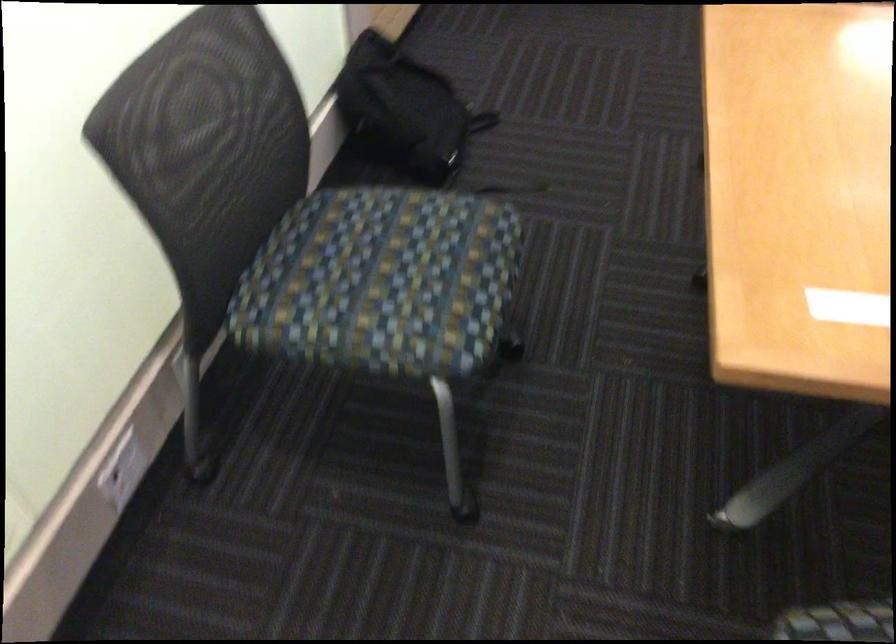
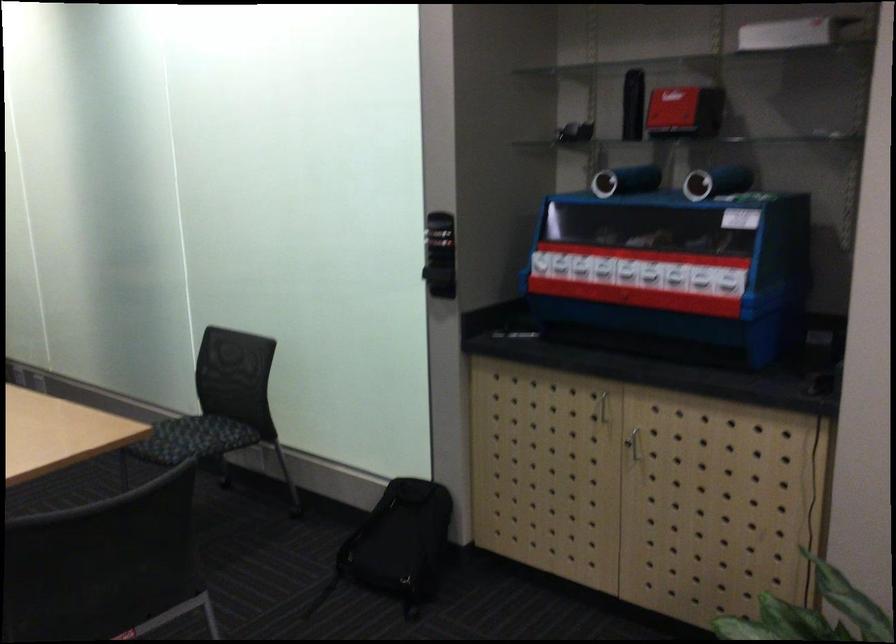
Question: I am providing you with two images of the same scene from different viewpoints. Which of the following objects are not visible in image2?

Choices:
 (A) green toy tractor
 (B) black backpack
 (C) chair sitting surface
 (D) white box

Answer: (B)